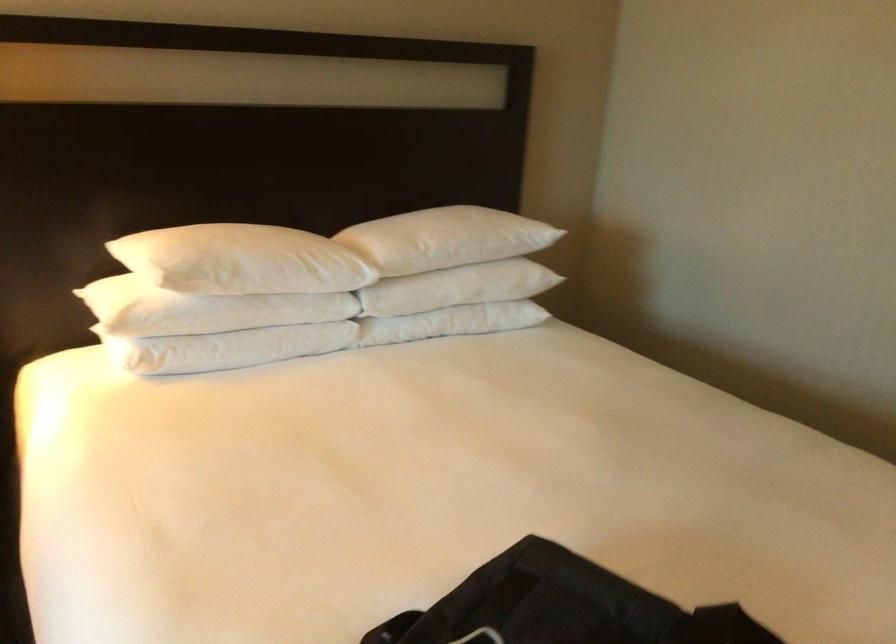
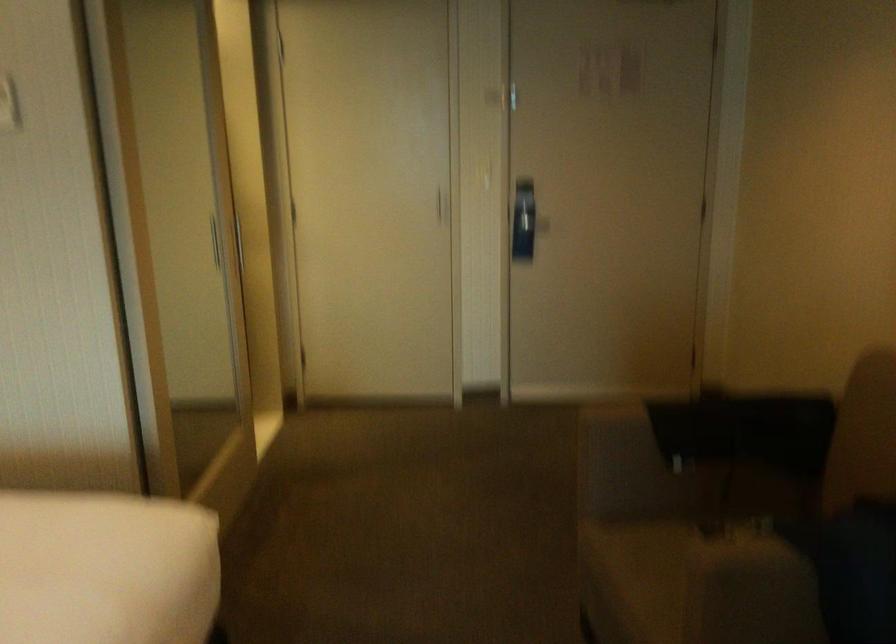
Question: Based on the continuous images, in which direction is the camera rotating? Reply with the corresponding letter.

Choices:
 (A) Left
 (B) Right
 (C) Up
 (D) Down

Answer: (B)